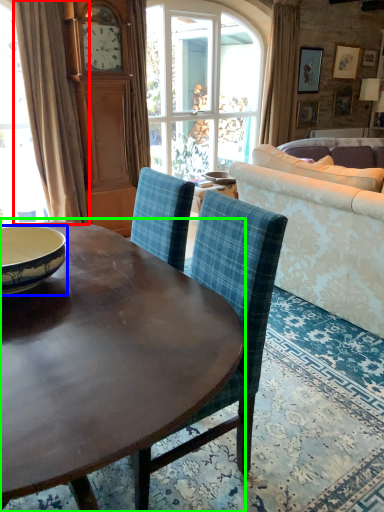
Question: Which object is positioned closest to curtain (highlighted by a red box)? Select from bowl (highlighted by a blue box) and coffee table (highlighted by a green box).

Choices:
 (A) bowl
 (B) coffee table

Answer: (A)